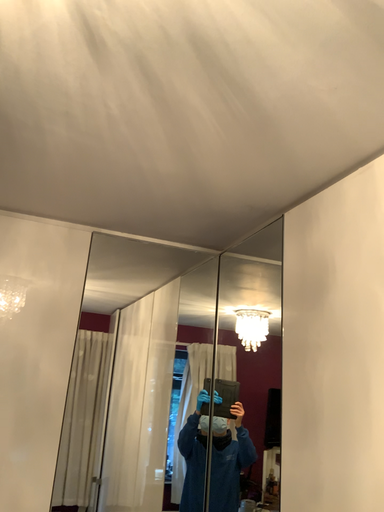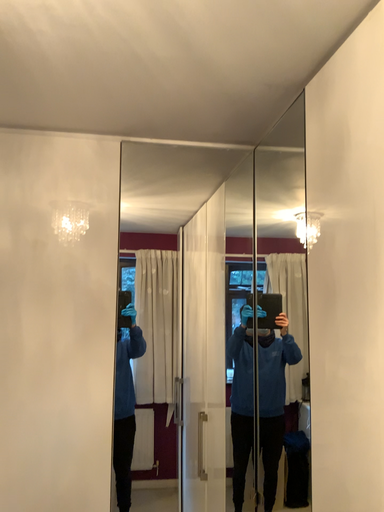
Question: Which way did the camera rotate in the video?

Choices:
 (A) rotated upward
 (B) rotated downward

Answer: (B)